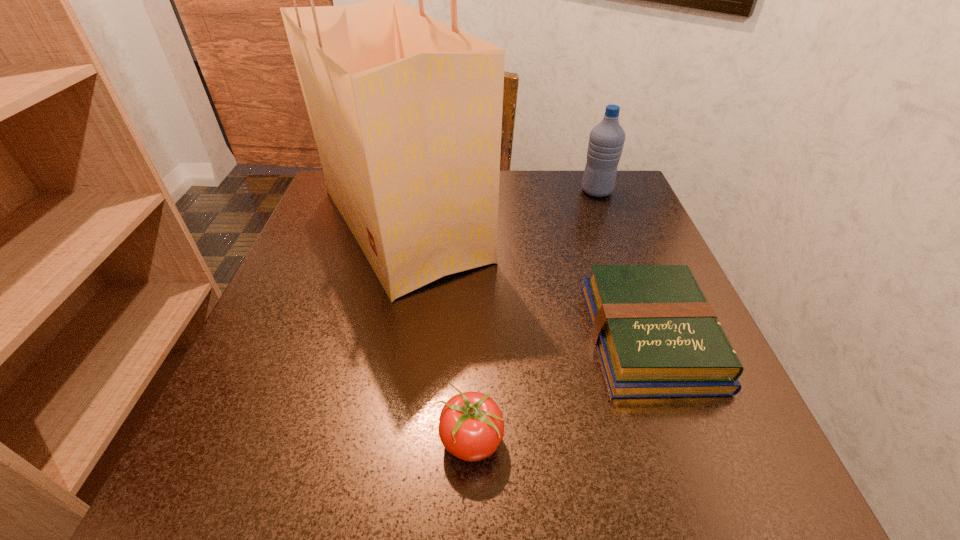
At what (x,y) coordinates should I click in order to perform the action: click on vacant space that satisfies the following two spatial constraints: 1. on the back side of the book; 2. on the right side of the tomato. Please return your answer as a coordinate pair (x, y). This screenshot has height=540, width=960. Looking at the image, I should click on (472, 336).